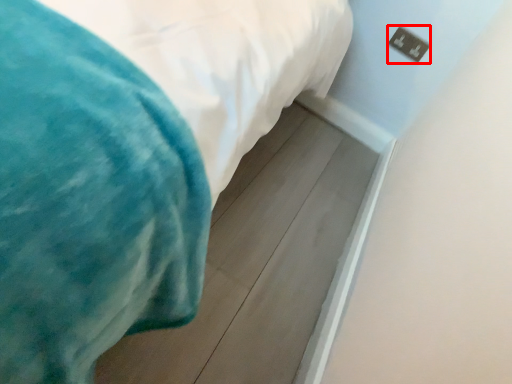
Question: Considering the relative positions of electric outlet (annotated by the red box) and bed in the image provided, where is electric outlet (annotated by the red box) located with respect to the staircase?

Choices:
 (A) left
 (B) right

Answer: (B)